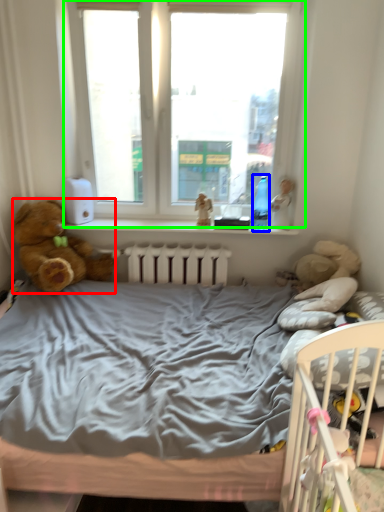
Question: Estimate the real-world distances between objects in this image. Which object is closer to teddy bear (highlighted by a red box), bottle (highlighted by a blue box) or window (highlighted by a green box)?

Choices:
 (A) bottle
 (B) window

Answer: (B)